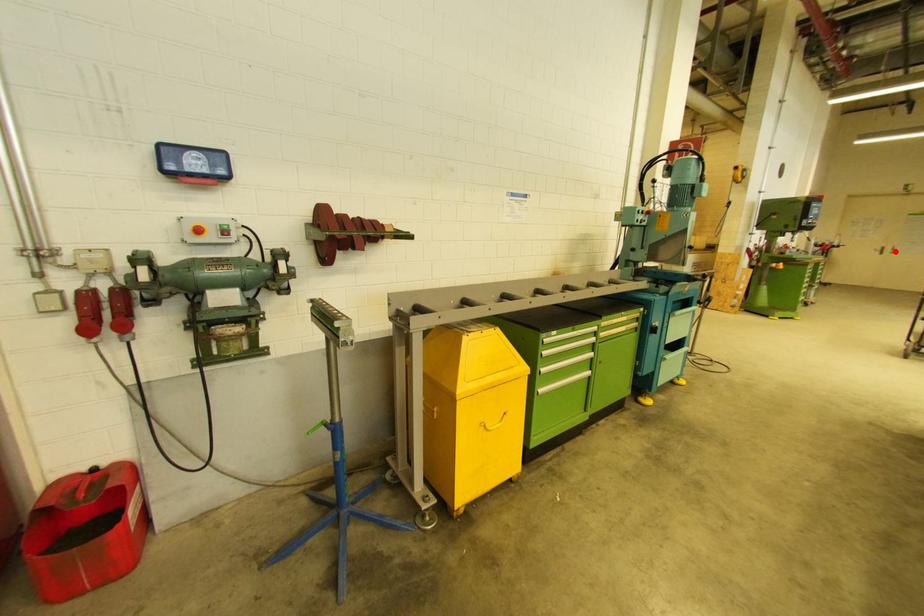
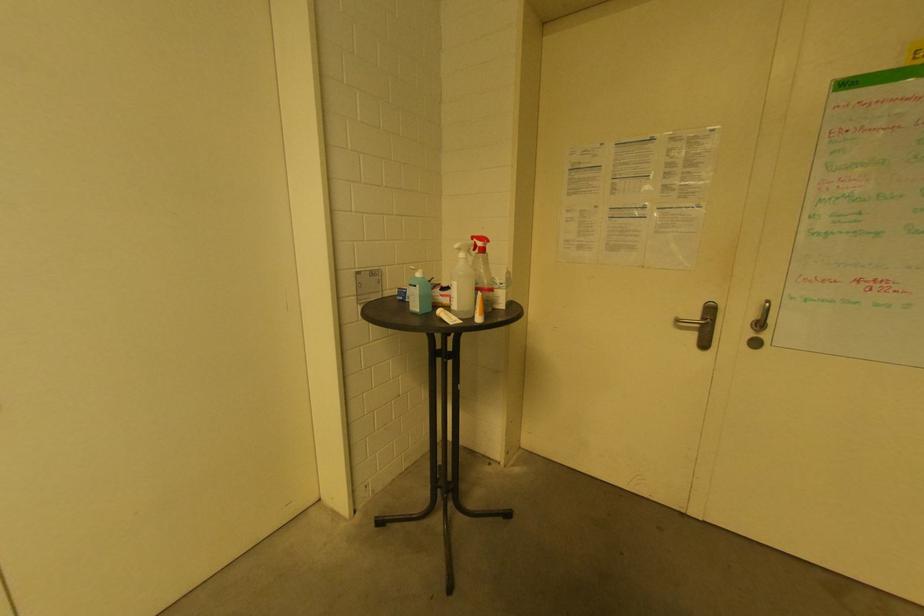
The point at the highlighted location is marked in the first image. Where is the corresponding point in the second image?

(761, 326)